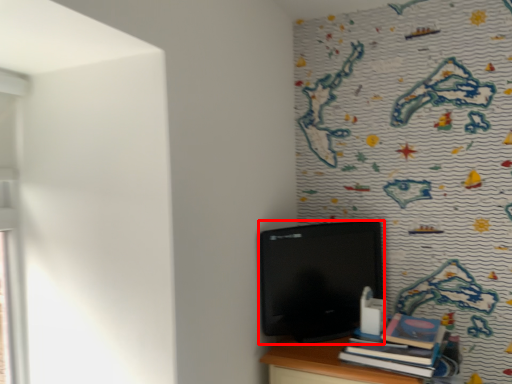
Question: In this image, where is computer (annotated by the red box) located relative to book?

Choices:
 (A) left
 (B) right

Answer: (A)